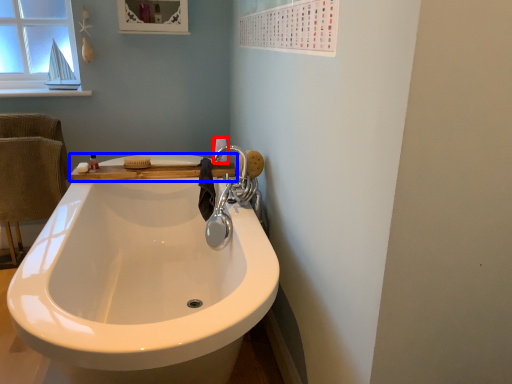
Question: Which of the following is the closest to the observer, toilet paper (highlighted by a red box) or counter top (highlighted by a blue box)?

Choices:
 (A) toilet paper
 (B) counter top

Answer: (B)